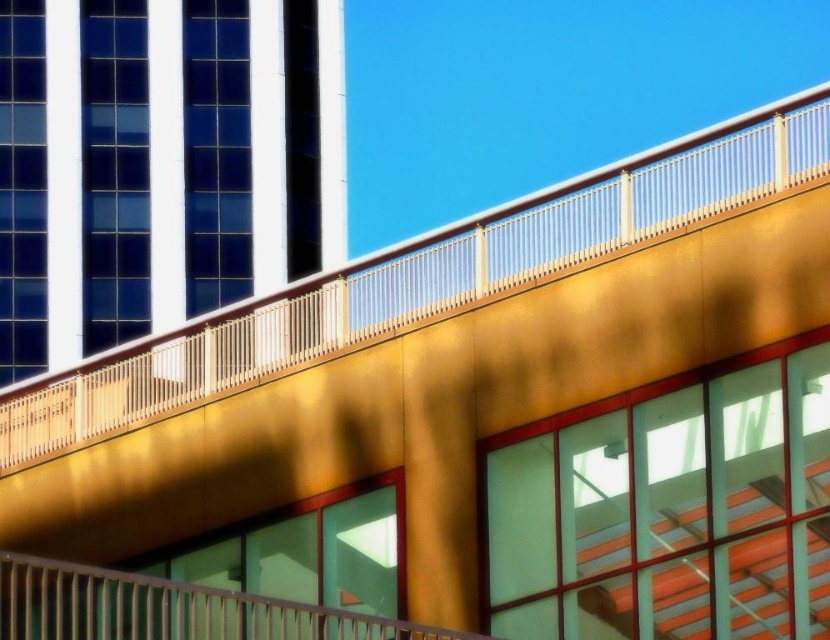
Question: Can you confirm if gold metallic balcony at upper center is positioned to the left of metallic silver railing at center?

Choices:
 (A) yes
 (B) no

Answer: (A)

Question: Which object appears closest to the camera in this image?

Choices:
 (A) gold metallic balcony at upper center
 (B) metallic silver railing at center

Answer: (B)

Question: Which object is farther from the camera taking this photo?

Choices:
 (A) gold metallic balcony at upper center
 (B) metallic silver railing at center

Answer: (A)

Question: Which point is farther to the camera?

Choices:
 (A) metallic silver railing at center
 (B) gold metallic balcony at upper center

Answer: (B)

Question: Is gold metallic balcony at upper center in front of metallic silver railing at center?

Choices:
 (A) no
 (B) yes

Answer: (A)

Question: Where is gold metallic balcony at upper center located in relation to metallic silver railing at center in the image?

Choices:
 (A) below
 (B) above

Answer: (B)